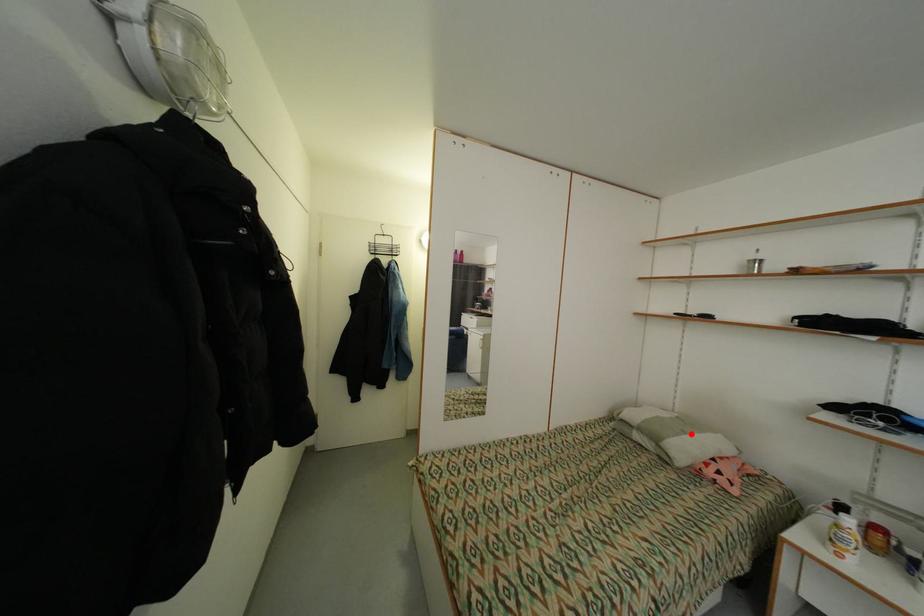
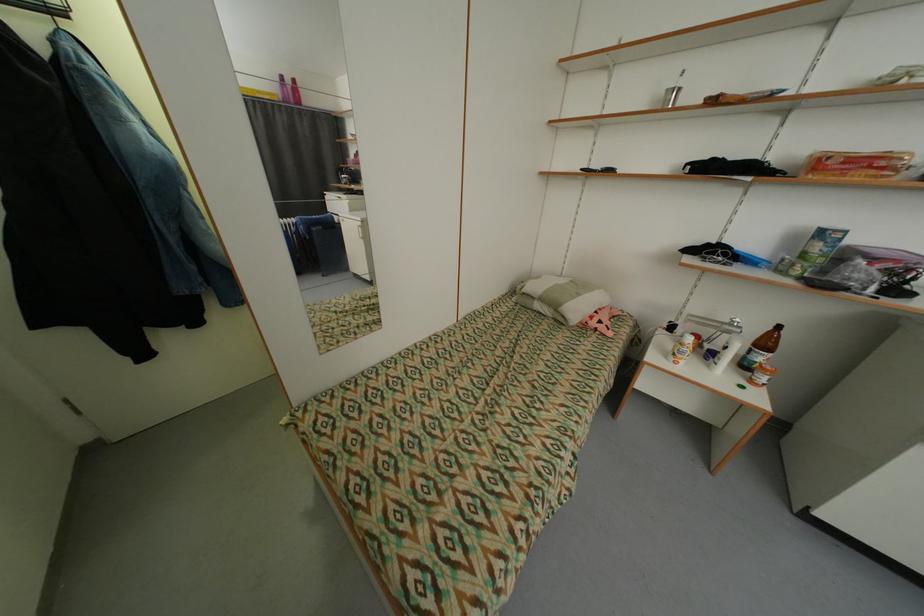
The point at the highlighted location is marked in the first image. Where is the corresponding point in the second image?

(585, 296)